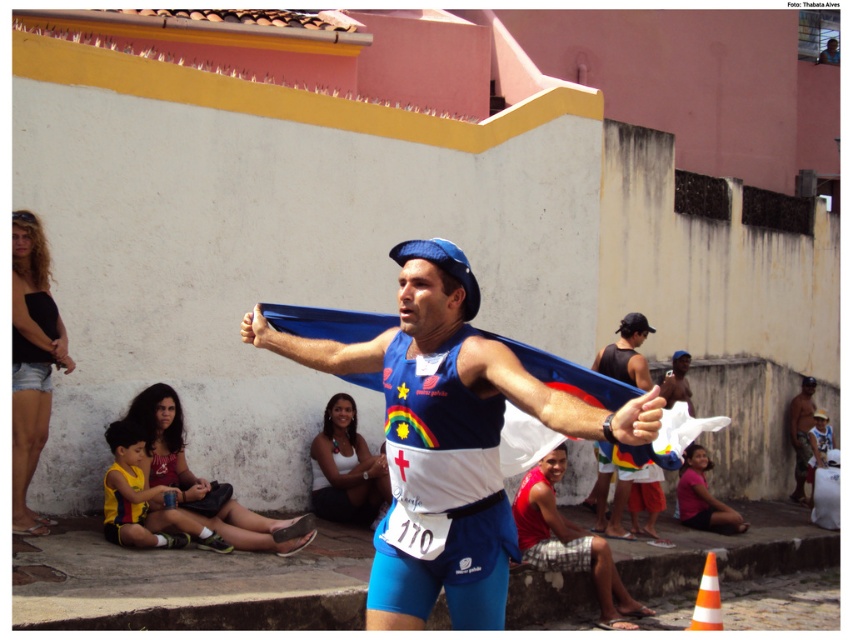
Between blue fabric flag at center and red fabric at lower right, which one has more height?

With more height is red fabric at lower right.

The image size is (853, 640). In order to click on blue fabric flag at center in this screenshot , I will do [x=567, y=374].

Is point (364, 337) in front of point (561, 570)?

Yes, it is.

What are the coordinates of `blue fabric flag at center` in the screenshot? It's located at [567, 374].

Who is more distant from viewer, (376, 547) or (621, 595)?

The point (621, 595) is behind.

Is matte blue fabric at center positioned in front of red fabric at lower right?

Yes, matte blue fabric at center is closer to the viewer.

Does point (491, 433) come closer to viewer compared to point (590, 560)?

Yes, it is.

You are a GUI agent. You are given a task and a screenshot of the screen. Output one action in this format:
    pyautogui.click(x=<x>, y=<y>)
    Task: Click on the matte blue fabric at center
    The image size is (853, 640).
    Given the screenshot: What is the action you would take?
    pyautogui.click(x=450, y=433)

Between red fabric at lower right and orange striped traffic cone at lower right, which one is positioned higher?

Positioned higher is red fabric at lower right.

Is red fabric at lower right to the left of orange striped traffic cone at lower right from the viewer's perspective?

Indeed, red fabric at lower right is positioned on the left side of orange striped traffic cone at lower right.

Between point (605, 605) and point (706, 614), which one is positioned in front?

Positioned in front is point (706, 614).

Where is `red fabric at lower right`? The image size is (853, 640). red fabric at lower right is located at coordinates (567, 541).